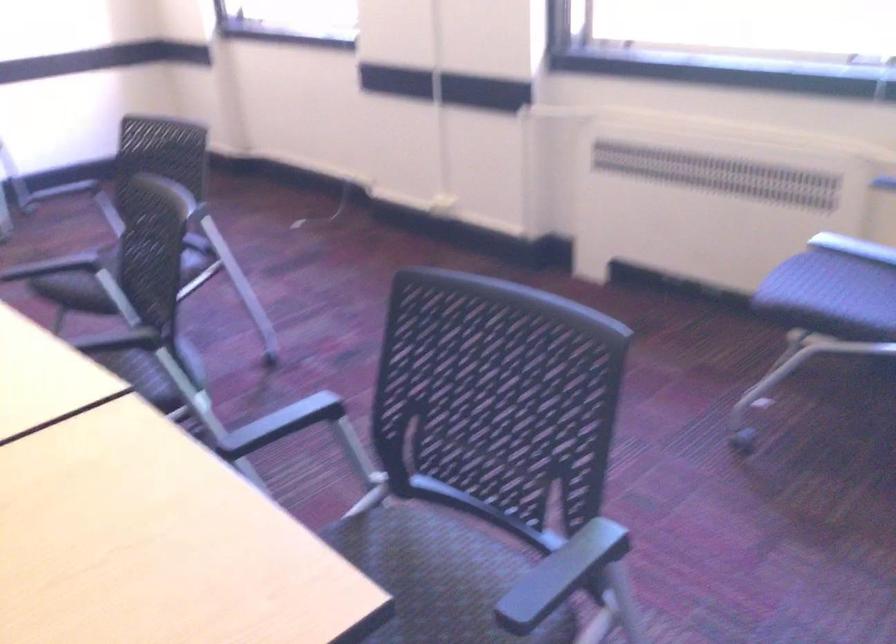
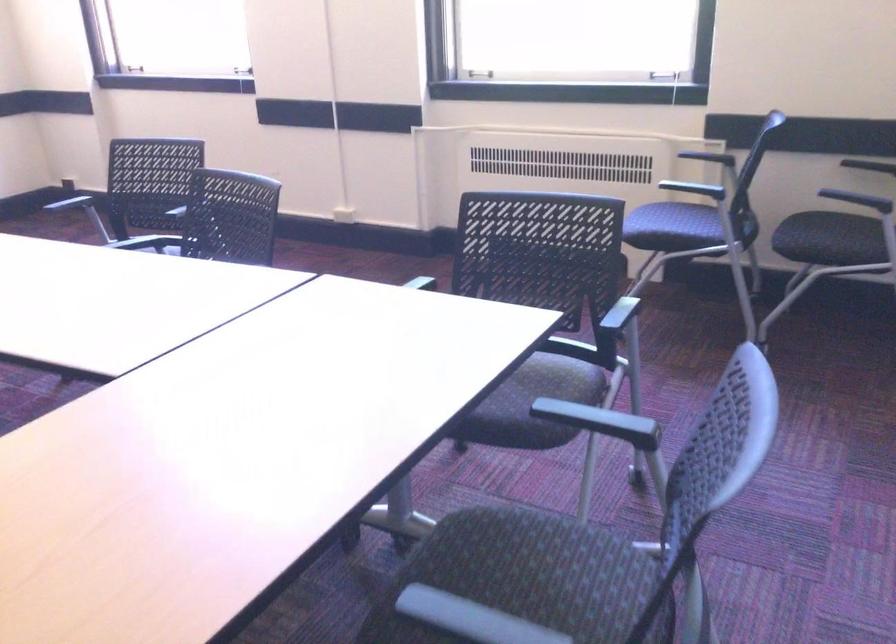
In the second image, find the point that corresponds to the point at 819,290 in the first image.

(662, 220)